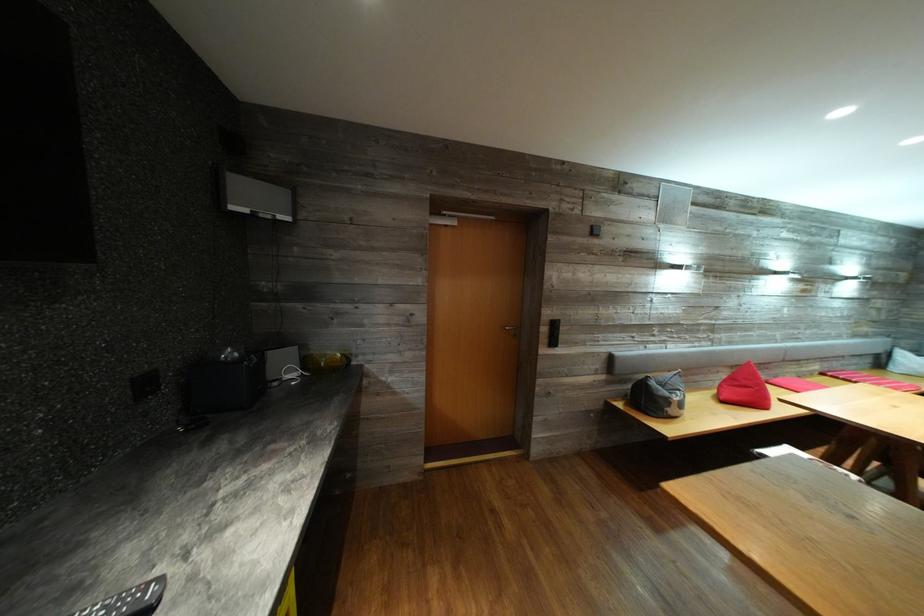
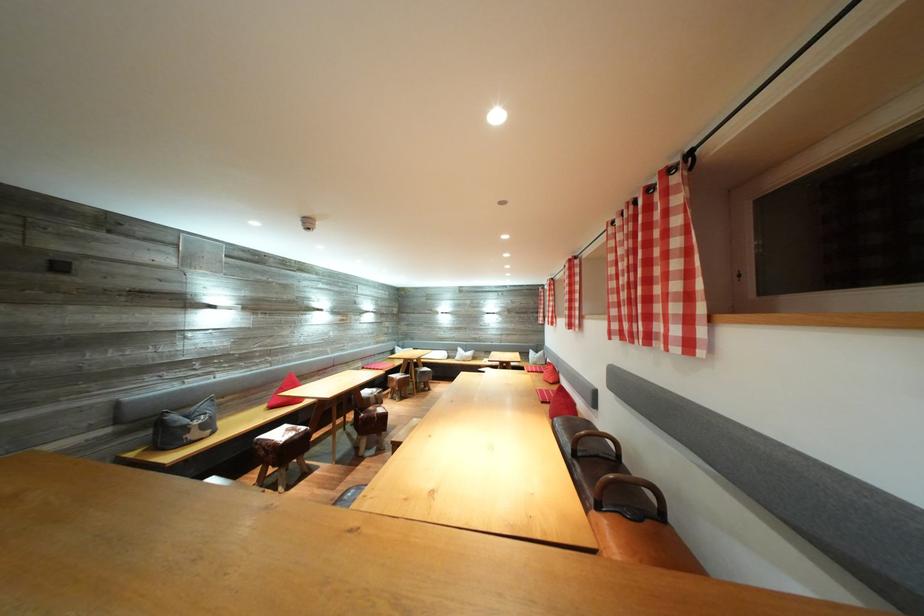
In the second image, find the point that corresponds to (672,399) in the first image.

(192, 427)